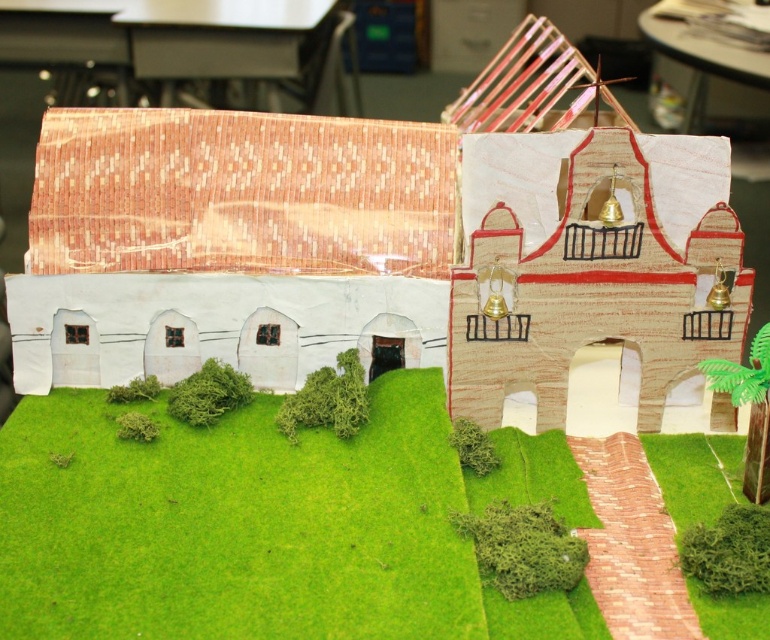
Question: Is green artificial turf at lower center thinner than cardboard model building at center?

Choices:
 (A) yes
 (B) no

Answer: (A)

Question: Which point is closer to the camera?

Choices:
 (A) (95, 125)
 (B) (330, 572)

Answer: (B)

Question: Does green artificial turf at lower center appear over cardboard model building at center?

Choices:
 (A) no
 (B) yes

Answer: (A)

Question: Does green artificial turf at lower center appear on the right side of cardboard model building at center?

Choices:
 (A) yes
 (B) no

Answer: (B)